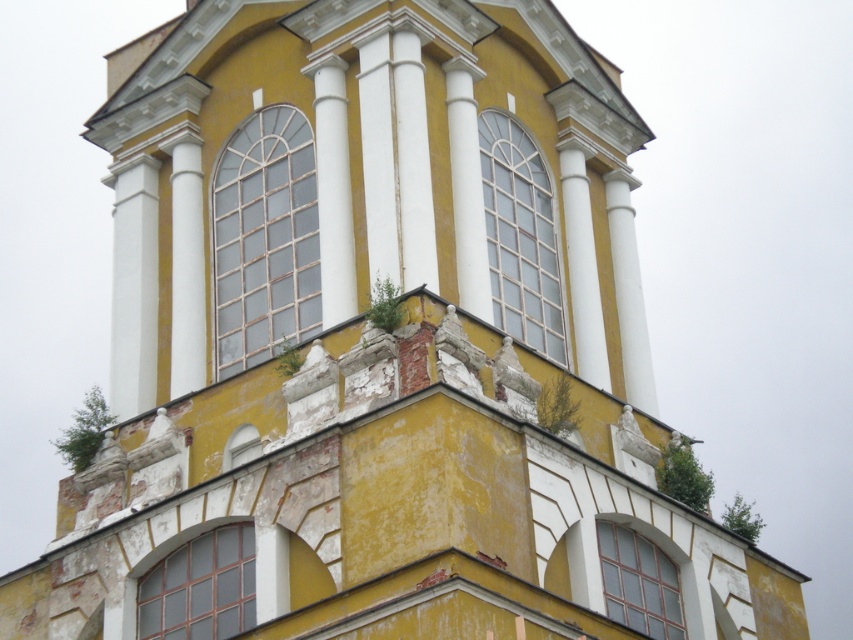
You are a window installer assessing the building. You need to replace the clear glass window at center and the matte glass window at lower center. Which window should you replace first if you want to start from the left side of the building?

Answer: You should replace the matte glass window at lower center first because it is located to the left of the clear glass window at center.

You are an architect assessing the building facade. You need to determine which window has a greater width between the matte glass window at center and the clear glass window at lower right based on the visible structure. Which one is wider?

The matte glass window at center is wider than the clear glass window at lower right according to the description.

Looking at this image, you are an architect inspecting the building facade. You notice two windows, the matte glass window at center and the clear glass window at lower right. Which window is located higher up on the building?

The matte glass window at center is positioned over the clear glass window at lower right, so it is higher up on the building.